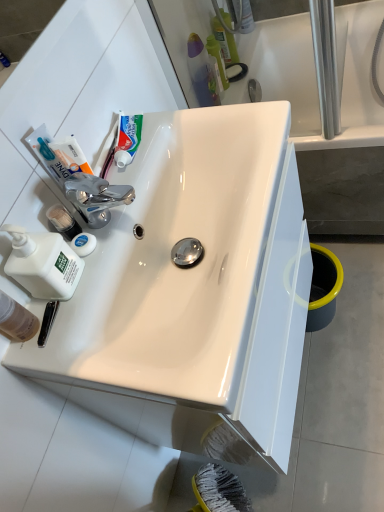
In order to click on vacant area that lies in front of white matte liquid soap at left in this screenshot , I will do `click(82, 335)`.